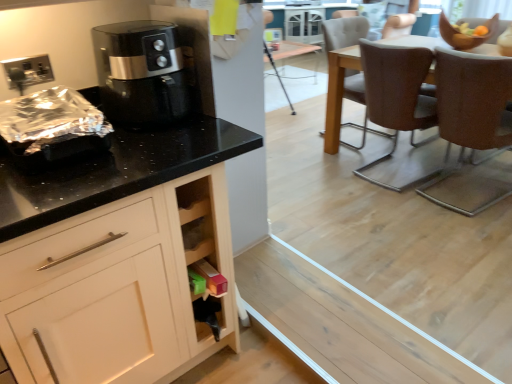
The image size is (512, 384). Find the location of `vacant space that's between brown leather chair at center, marked as the second chair in a back-to-front arrangement, and brown textured chair at right, placed as the third chair when sorted from front to back`. vacant space that's between brown leather chair at center, marked as the second chair in a back-to-front arrangement, and brown textured chair at right, placed as the third chair when sorted from front to back is located at coordinates (378, 150).